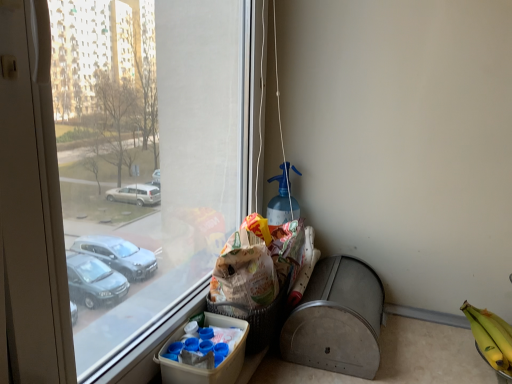
Question: From the image's perspective, does metallic gray recycling bin at lower right appear higher than white cardboard box at lower center?

Choices:
 (A) yes
 (B) no

Answer: (A)

Question: Would you consider metallic gray recycling bin at lower right to be distant from white cardboard box at lower center?

Choices:
 (A) no
 (B) yes

Answer: (A)

Question: Does metallic gray recycling bin at lower right contain white cardboard box at lower center?

Choices:
 (A) yes
 (B) no

Answer: (B)

Question: Can you confirm if metallic gray recycling bin at lower right is shorter than white cardboard box at lower center?

Choices:
 (A) no
 (B) yes

Answer: (A)

Question: Is the depth of metallic gray recycling bin at lower right less than that of white cardboard box at lower center?

Choices:
 (A) yes
 (B) no

Answer: (B)

Question: Is metallic gray recycling bin at lower right smaller than white cardboard box at lower center?

Choices:
 (A) no
 (B) yes

Answer: (A)

Question: Is brown paper bag at lower center at the back of metallic gray recycling bin at lower right?

Choices:
 (A) no
 (B) yes

Answer: (B)

Question: Does metallic gray recycling bin at lower right contain brown paper bag at lower center?

Choices:
 (A) yes
 (B) no

Answer: (B)

Question: Is metallic gray recycling bin at lower right smaller than brown paper bag at lower center?

Choices:
 (A) no
 (B) yes

Answer: (A)

Question: From the image's perspective, is metallic gray recycling bin at lower right on brown paper bag at lower center?

Choices:
 (A) no
 (B) yes

Answer: (A)

Question: From a real-world perspective, is metallic gray recycling bin at lower right under brown paper bag at lower center?

Choices:
 (A) no
 (B) yes

Answer: (B)

Question: Can you confirm if metallic gray recycling bin at lower right is shorter than brown paper bag at lower center?

Choices:
 (A) no
 (B) yes

Answer: (A)

Question: From the image's perspective, would you say metallic gray recycling bin at lower right is shown under yellow matte bananas at lower right?

Choices:
 (A) yes
 (B) no

Answer: (B)